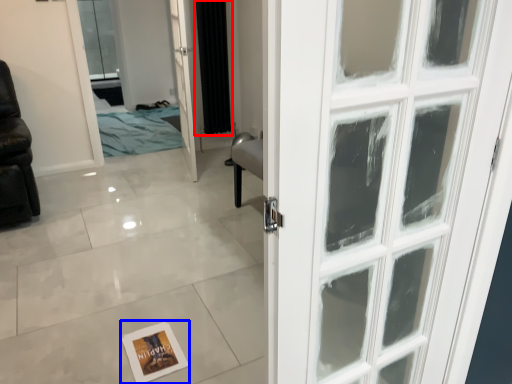
Question: Among these objects, which one is farthest to the camera, curtain (highlighted by a red box) or postcard (highlighted by a blue box)?

Choices:
 (A) curtain
 (B) postcard

Answer: (A)